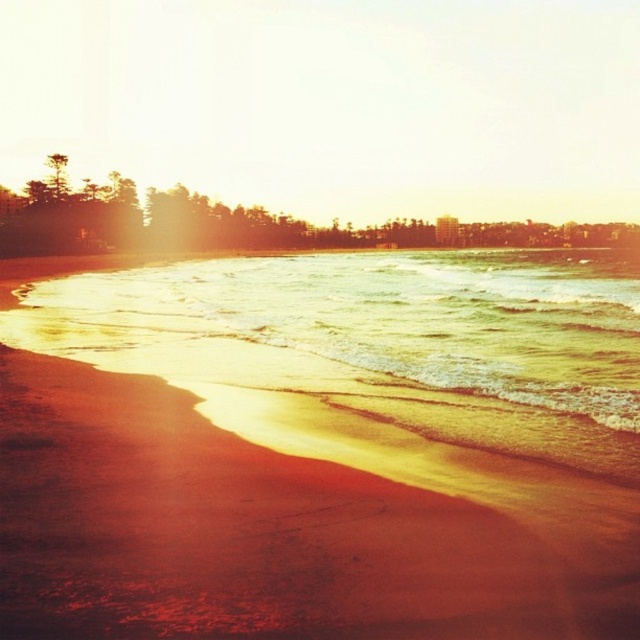
Does sandy beach at lower left lie behind sandy yellow water at lower left?

No.

Between sandy beach at lower left and sandy yellow water at lower left, which one appears on the right side from the viewer's perspective?

Positioned to the right is sandy yellow water at lower left.

Describe the element at coordinates (253, 532) in the screenshot. I see `sandy beach at lower left` at that location.

This screenshot has height=640, width=640. I want to click on sandy beach at lower left, so click(253, 532).